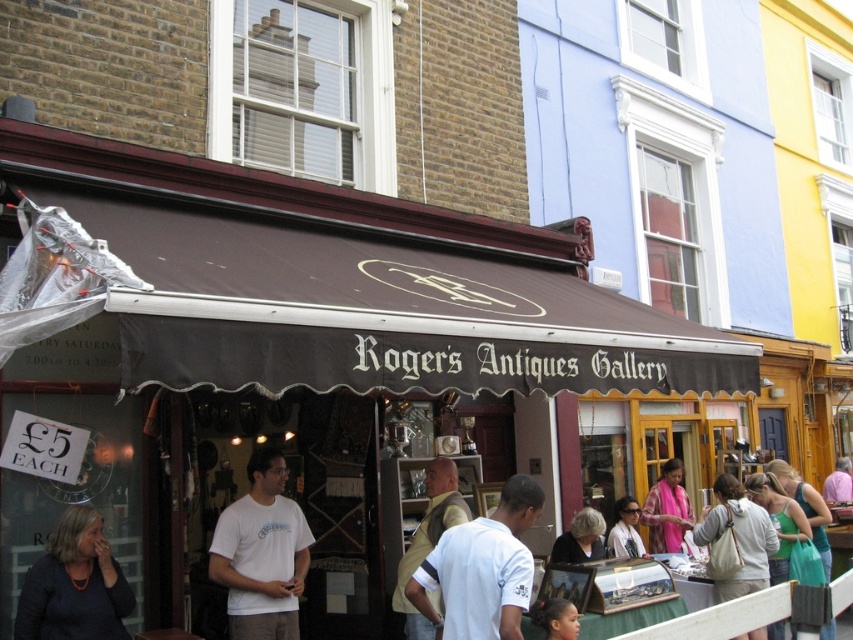
Between white cotton hoodie at lower right and gray hair at center, which one appears on the right side from the viewer's perspective?

white cotton hoodie at lower right is more to the right.

Does point (723, 477) come behind point (577, 538)?

That is True.

Identify the location of white cotton hoodie at lower right. The height and width of the screenshot is (640, 853). (738, 536).

Consider the image. Can you confirm if beige fabric vest at center is positioned to the right of gray hair at center?

Incorrect, beige fabric vest at center is not on the right side of gray hair at center.

This screenshot has width=853, height=640. What are the coordinates of `beige fabric vest at center` in the screenshot? It's located at (428, 540).

Find the location of a particular element. The image size is (853, 640). beige fabric vest at center is located at coordinates (428, 540).

Who is positioned more to the left, pink fabric scarf at center or gray hair at center?

From the viewer's perspective, gray hair at center appears more on the left side.

Is pink fabric scarf at center above gray hair at center?

Incorrect, pink fabric scarf at center is not positioned above gray hair at center.

At what (x,y) coordinates should I click in order to perform the action: click on pink fabric scarf at center. Please return your answer as a coordinate pair (x, y). The height and width of the screenshot is (640, 853). Looking at the image, I should click on (666, 509).